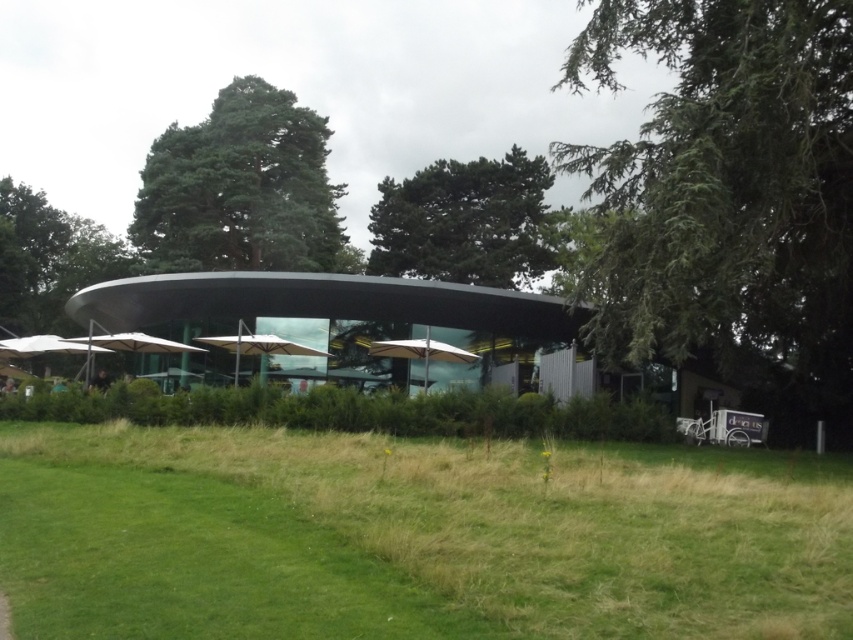
You are planning to install a new lighting system for the transparent glass umbrella at center and the white matte umbrella at left. Which umbrella requires taller lighting fixtures to accommodate its height?

The white matte umbrella at left requires taller lighting fixtures because it is taller than the transparent glass umbrella at center.